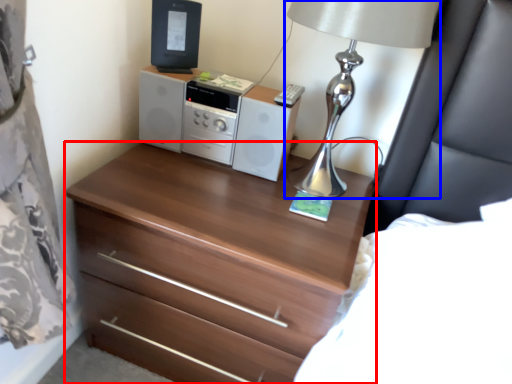
Question: Which object is closer to the camera taking this photo, chest of drawers (highlighted by a red box) or table lamp (highlighted by a blue box)?

Choices:
 (A) chest of drawers
 (B) table lamp

Answer: (B)